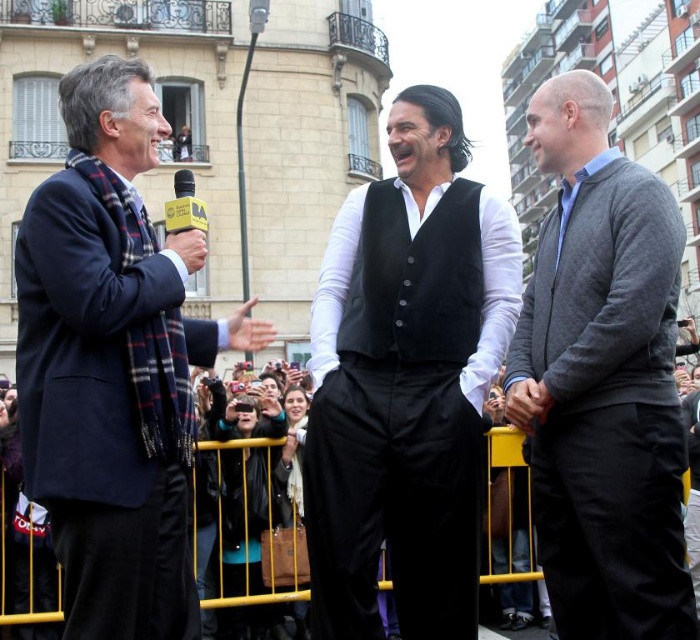
Question: Which point appears farthest from the camera in this image?

Choices:
 (A) coord(141,365)
 (B) coord(491,275)

Answer: (B)

Question: Is velvet black vest at center above matte black coat at left?

Choices:
 (A) no
 (B) yes

Answer: (A)

Question: Does matte black coat at left lie in front of gray wool sweater at right?

Choices:
 (A) no
 (B) yes

Answer: (B)

Question: Which point is farther to the camera?

Choices:
 (A) (111, 301)
 (B) (349, 333)
 (C) (396, 298)

Answer: (B)

Question: Is velvet black vest at center closer to camera compared to black matte vest at center?

Choices:
 (A) yes
 (B) no

Answer: (A)

Question: Which object is closer to the camera taking this photo?

Choices:
 (A) black matte vest at center
 (B) velvet black vest at center

Answer: (B)